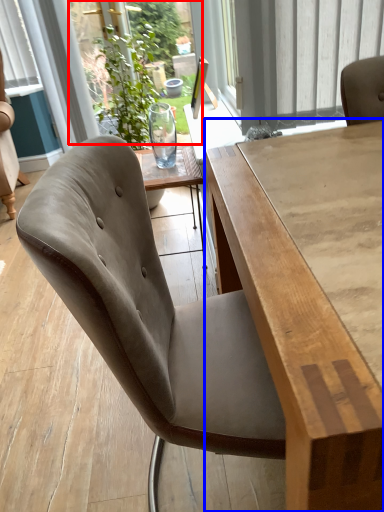
Question: Which point is further to the camera, window screen (highlighted by a red box) or table (highlighted by a blue box)?

Choices:
 (A) window screen
 (B) table

Answer: (A)